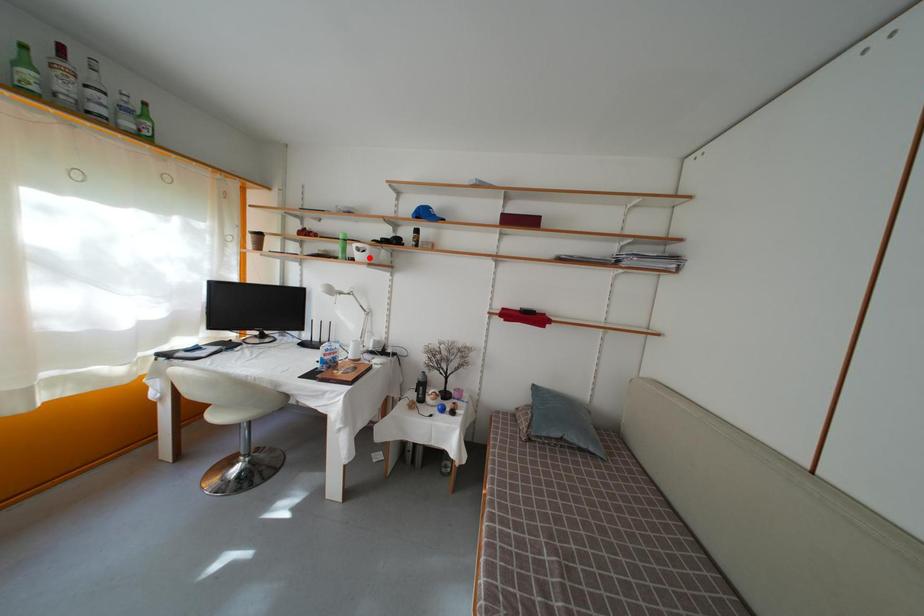
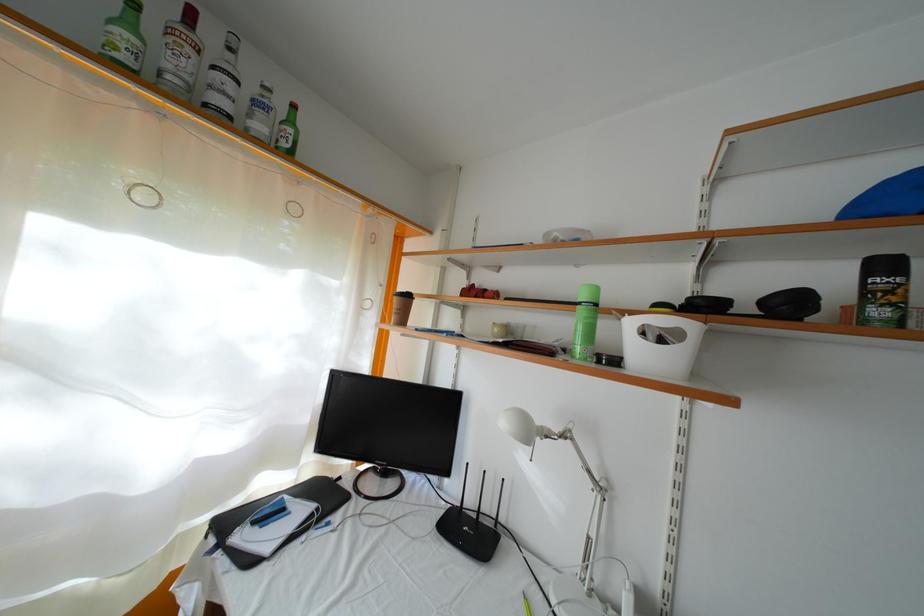
In the second image, find the point that corresponds to the highlighted location in the first image.

(667, 346)